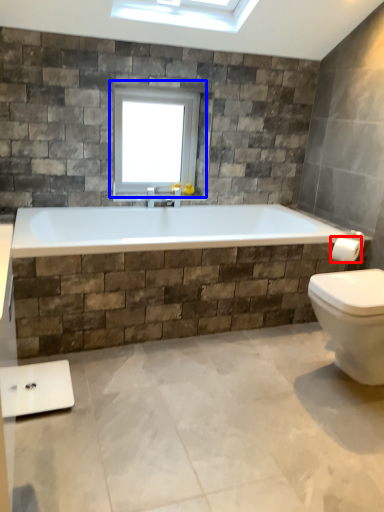
Question: Which object appears farthest to the camera in this image, towel bar (highlighted by a red box) or window (highlighted by a blue box)?

Choices:
 (A) towel bar
 (B) window

Answer: (B)